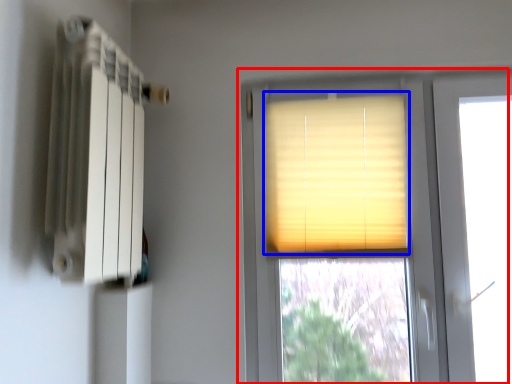
Question: Which point is closer to the camera, window (highlighted by a red box) or window blind (highlighted by a blue box)?

Choices:
 (A) window
 (B) window blind

Answer: (A)